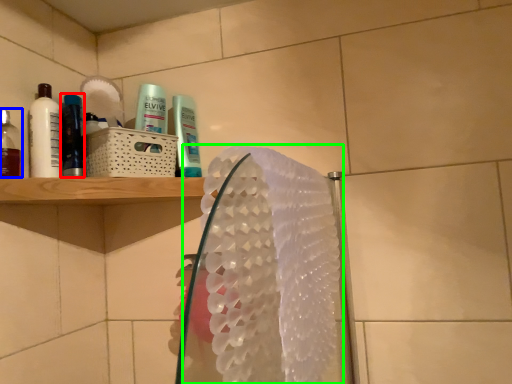
Question: Which object is positioned closest to mouthwash (highlighted by a red box)? Select from mouthwash (highlighted by a blue box) and hand towel (highlighted by a green box).

Choices:
 (A) mouthwash
 (B) hand towel

Answer: (A)